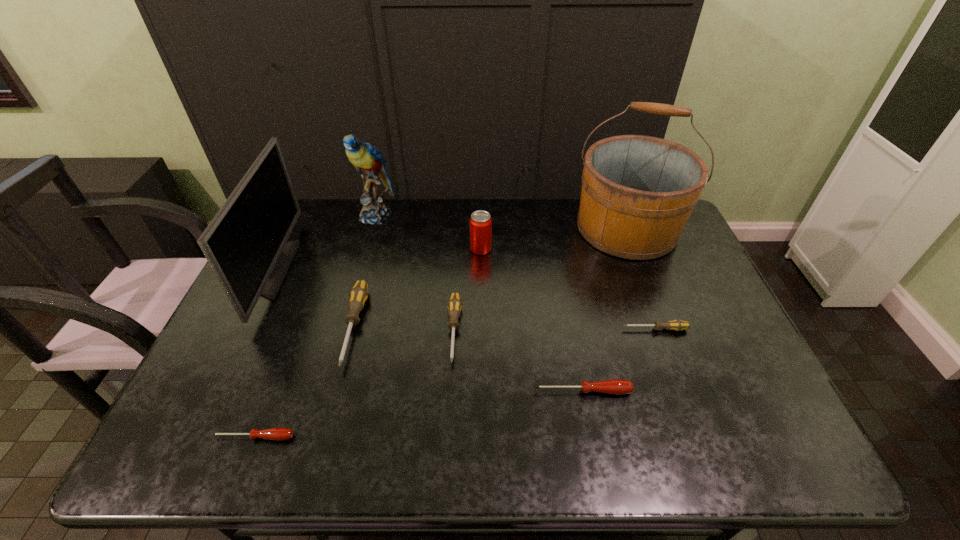
At what (x,y) coordinates should I click in order to perform the action: click on free space between the black monitor and the rightmost screwdriver. Please return your answer as a coordinate pair (x, y). The height and width of the screenshot is (540, 960). Looking at the image, I should click on (464, 299).

Find the location of a particular element. This screenshot has height=540, width=960. unoccupied position between the shortest screwdriver and the fourth object from right to left is located at coordinates (368, 343).

Identify the location of object that stands as the seventh closest to the biggest gray screwdriver. (638, 192).

Where is `object that is the third closest to the red can`? The height and width of the screenshot is (540, 960). object that is the third closest to the red can is located at coordinates (638, 192).

Locate which screwdriver is the third closest to the fifth object from left to right. Please provide its 2D coordinates. Your answer should be formatted as a tuple, i.e. [(x, y)], where the tuple contains the x and y coordinates of a point satisfying the conditions above.

[(278, 434)]

Choose which screwdriver is the second nearest neighbor to the shortest object. Please provide its 2D coordinates. Your answer should be formatted as a tuple, i.e. [(x, y)], where the tuple contains the x and y coordinates of a point satisfying the conditions above.

[(454, 305)]

Choose which gray screwdriver is the second nearest neighbor to the second screwdriver from left to right. Please provide its 2D coordinates. Your answer should be formatted as a tuple, i.e. [(x, y)], where the tuple contains the x and y coordinates of a point satisfying the conditions above.

[(677, 325)]

Where is `gray screwdriver object that ranks as the closest to the shortest screwdriver`? gray screwdriver object that ranks as the closest to the shortest screwdriver is located at coordinates coord(358,294).

At what (x,y) coordinates should I click in order to perform the action: click on free spot that satisfies the following two spatial constraints: 1. on the screen side of the black monitor; 2. on the left side of the smaller red screwdriver. Please return your answer as a coordinate pair (x, y). This screenshot has height=540, width=960. Looking at the image, I should click on (189, 437).

The width and height of the screenshot is (960, 540). In order to click on vacant position in the image that satisfies the following two spatial constraints: 1. on the face of the parrot; 2. on the screen side of the monitor in this screenshot , I will do `click(360, 269)`.